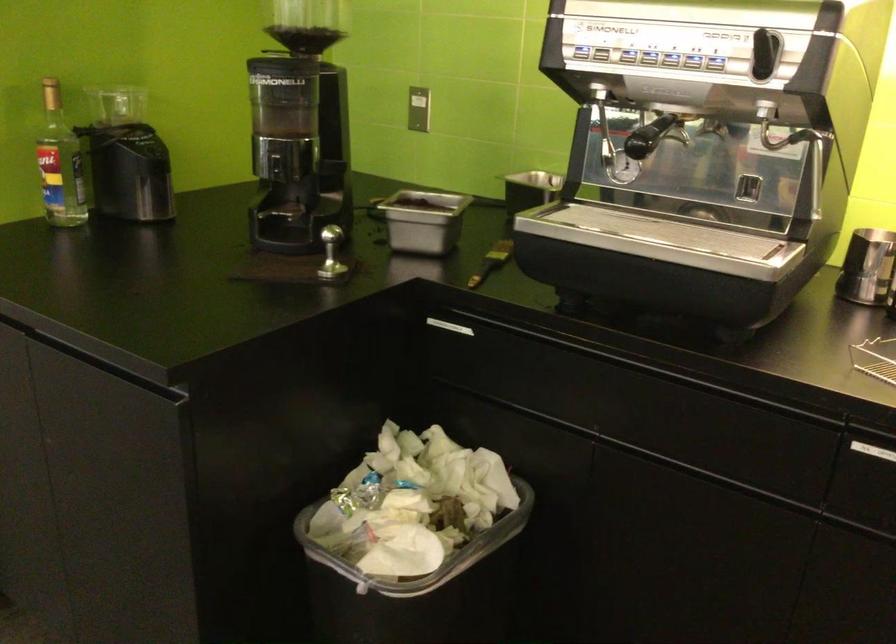
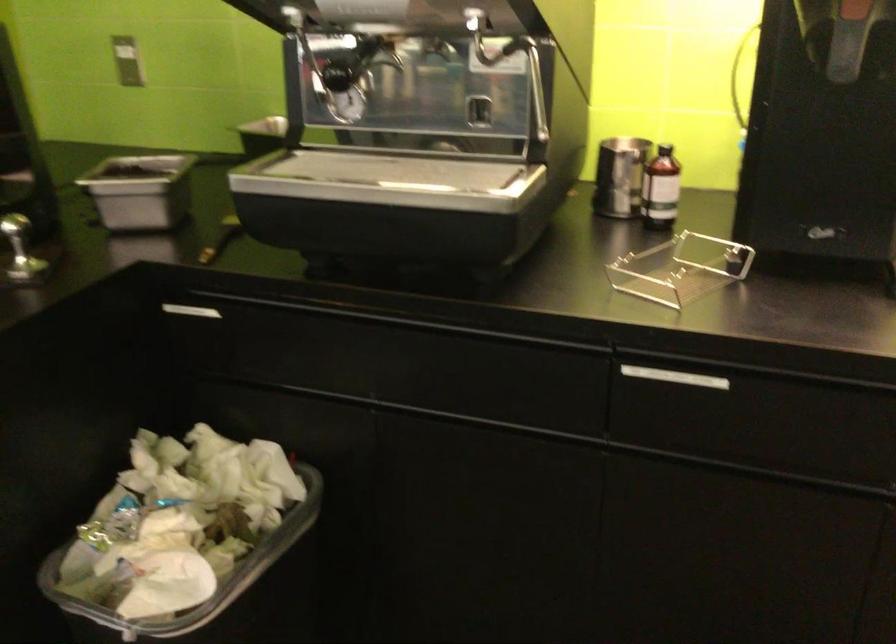
Find the pixel in the second image that matches point 437,571 in the first image.

(218, 592)